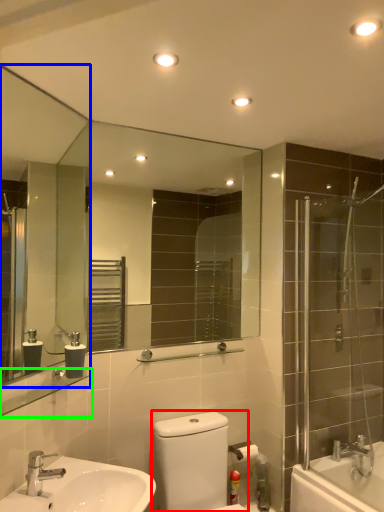
Question: Based on their relative distances, which object is farther from gray (highlighted by a red box)? Choose from mirror (highlighted by a blue box) and balustrade (highlighted by a green box).

Choices:
 (A) mirror
 (B) balustrade

Answer: (A)